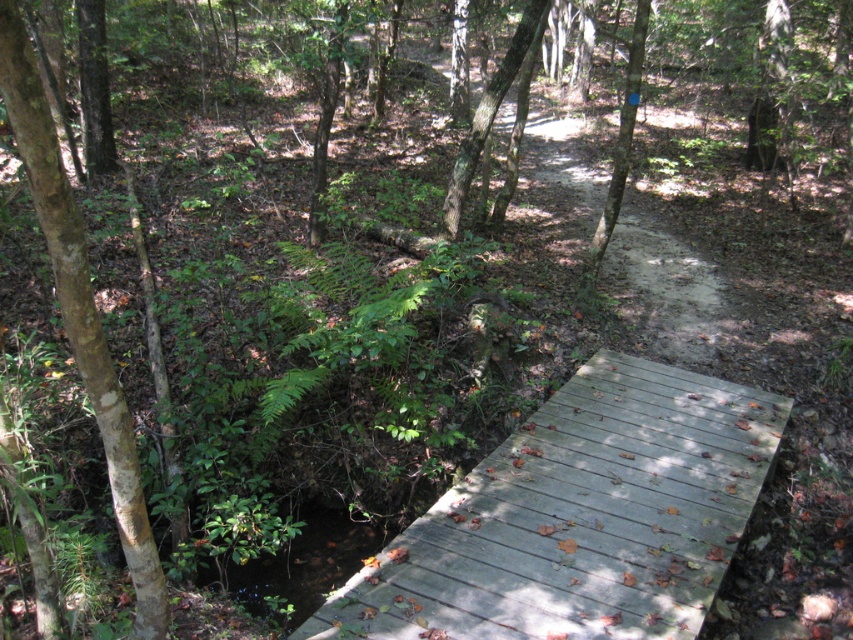
In the scene shown: You are standing at the wooden bridge in the forest scene. You notice two points marked in the image. The first point is at coordinates point (64, 186) and the second point is at point (541, 10). Which of these two points is physically closer to your current position on the bridge?

Point (64, 186) is closer to the camera than point (541, 10), so the first point is closer to your current position on the bridge.

You are standing on the wooden bridge in the forest scene and notice a point marked at coordinates (x=80, y=314). What object is located at this point?

The point at coordinates (x=80, y=314) indicates a brown and scaly tree trunk at the left side of the scene.